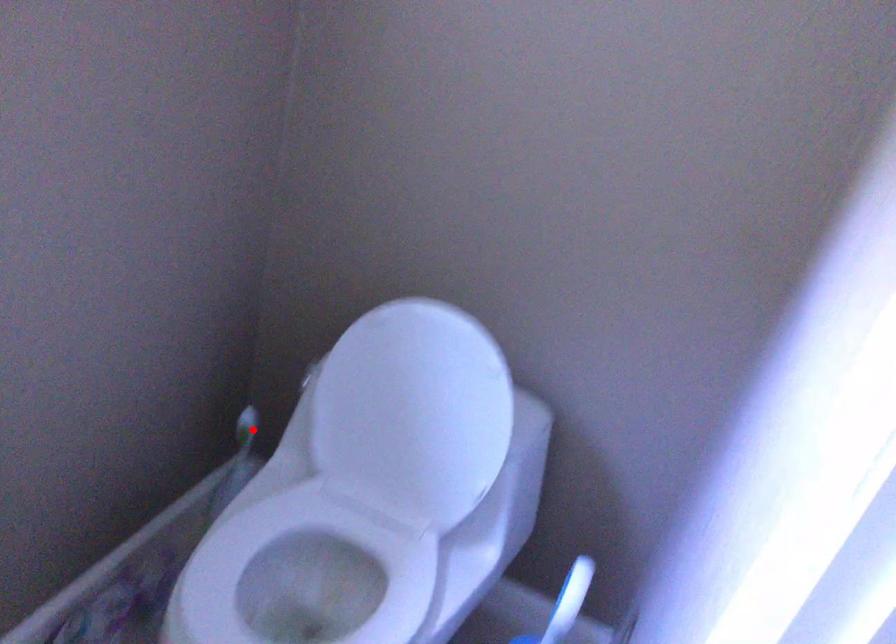
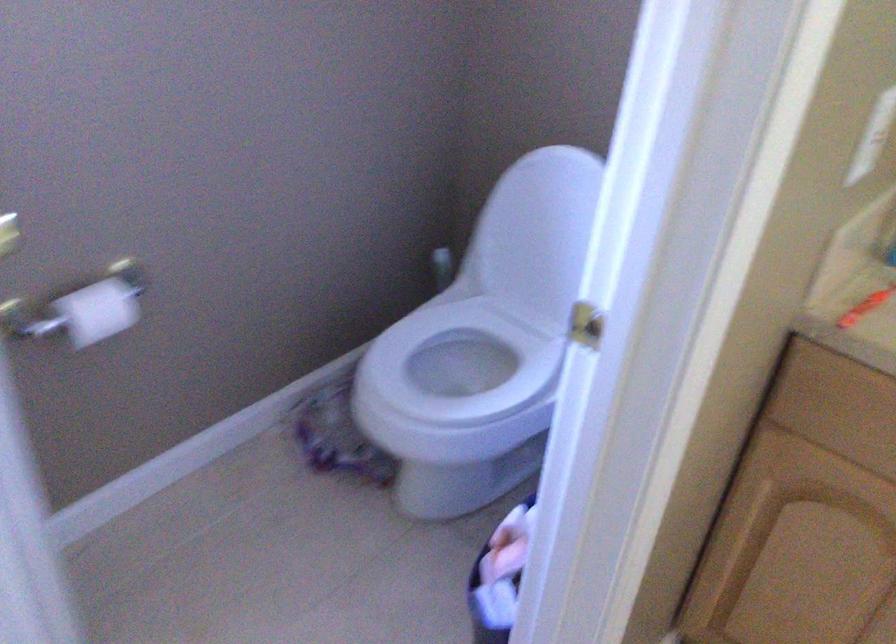
Question: A red point is marked in image1. In image2, is the corresponding 3D point closer to the camera or farther? Reply with the corresponding letter.

Choices:
 (A) The corresponding 3D point is closer.
 (B) The corresponding 3D point is farther.

Answer: (B)